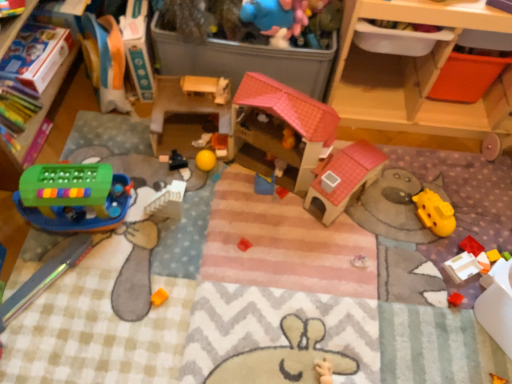
Locate an element on the screen. vacant area that lies between green plastic boat at left, the ninth toy viewed from the right, and white plastic block at lower right, acting as the eighth toy starting from the left is located at coordinates (276, 247).